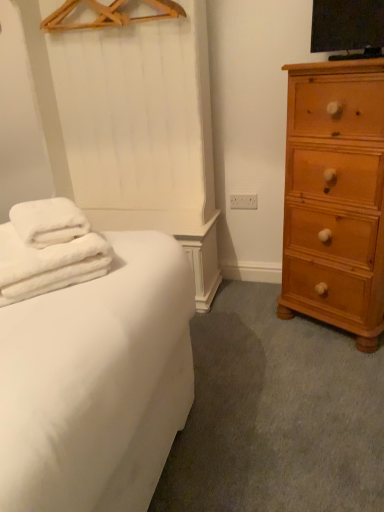
Question: Considering the relative positions of wooden hanger at upper center and light brown wooden chest of drawers at right in the image provided, is wooden hanger at upper center to the right of light brown wooden chest of drawers at right from the viewer's perspective?

Choices:
 (A) yes
 (B) no

Answer: (B)

Question: Would you consider wooden hanger at upper center to be distant from light brown wooden chest of drawers at right?

Choices:
 (A) yes
 (B) no

Answer: (A)

Question: Considering the relative sizes of wooden hanger at upper center and light brown wooden chest of drawers at right in the image provided, is wooden hanger at upper center thinner than light brown wooden chest of drawers at right?

Choices:
 (A) yes
 (B) no

Answer: (A)

Question: Does wooden hanger at upper center have a larger size compared to light brown wooden chest of drawers at right?

Choices:
 (A) no
 (B) yes

Answer: (A)

Question: From the image's perspective, would you say wooden hanger at upper center is positioned over light brown wooden chest of drawers at right?

Choices:
 (A) no
 (B) yes

Answer: (B)

Question: Considering the relative sizes of wooden hanger at upper center and light brown wooden chest of drawers at right in the image provided, is wooden hanger at upper center taller than light brown wooden chest of drawers at right?

Choices:
 (A) no
 (B) yes

Answer: (A)

Question: Is white fluffy towels at left oriented away from light brown wooden chest of drawers at right?

Choices:
 (A) no
 (B) yes

Answer: (A)

Question: From a real-world perspective, is white fluffy towels at left beneath light brown wooden chest of drawers at right?

Choices:
 (A) no
 (B) yes

Answer: (A)

Question: Would you say white fluffy towels at left is outside light brown wooden chest of drawers at right?

Choices:
 (A) no
 (B) yes

Answer: (B)

Question: Is white fluffy towels at left next to light brown wooden chest of drawers at right?

Choices:
 (A) no
 (B) yes

Answer: (A)

Question: Does white fluffy towels at left have a greater height compared to light brown wooden chest of drawers at right?

Choices:
 (A) no
 (B) yes

Answer: (A)

Question: Does white fluffy towels at left have a smaller size compared to light brown wooden chest of drawers at right?

Choices:
 (A) no
 (B) yes

Answer: (B)

Question: Can you confirm if light brown wooden chest of drawers at right is positioned to the right of white fluffy towels at left?

Choices:
 (A) yes
 (B) no

Answer: (A)